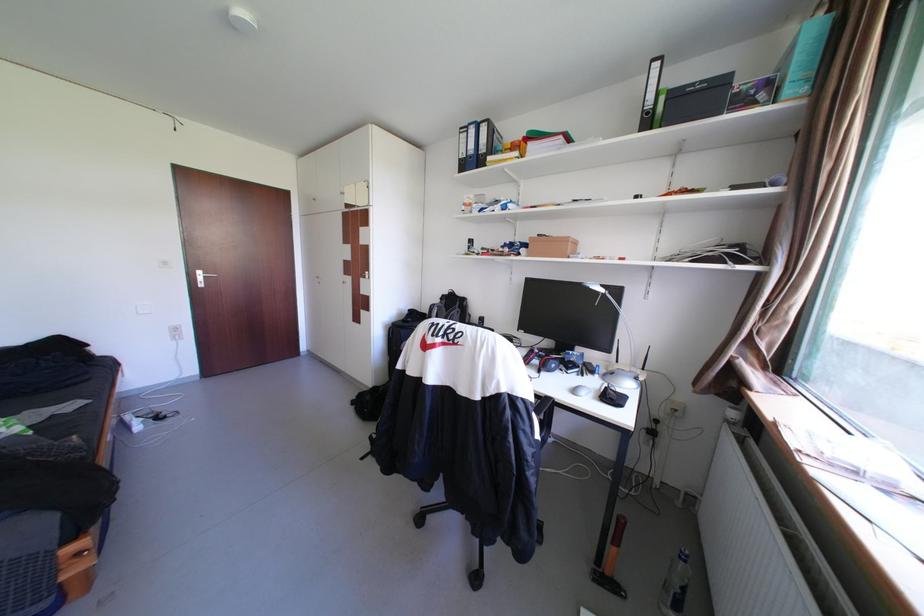
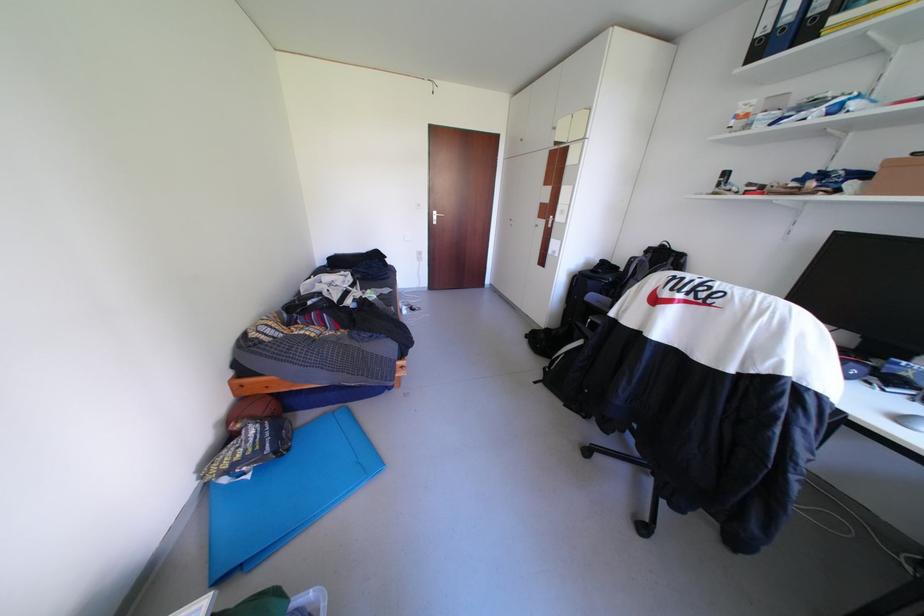
Question: How did the camera likely rotate?

Choices:
 (A) Left
 (B) Right
 (C) Up
 (D) Down

Answer: (A)